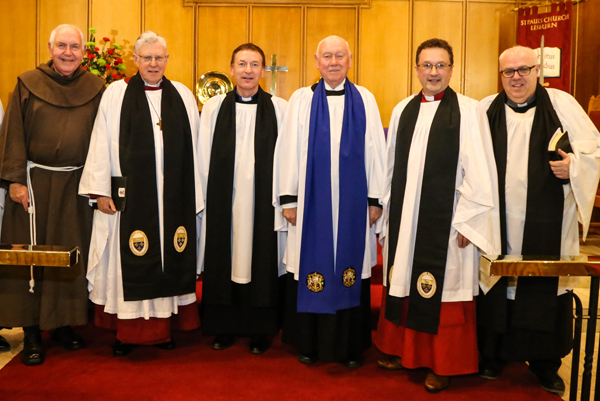
Locate an element on the screen. Image resolution: width=600 pixels, height=401 pixels. white robe is located at coordinates (110, 115), (207, 133), (296, 113), (395, 123), (580, 129).